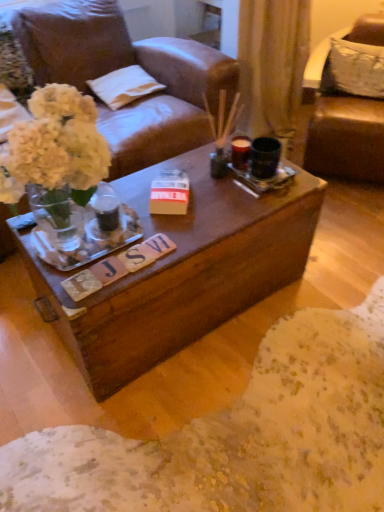
What is the approximate height of brown leather chair at upper right?

28.32 inches.

Describe the element at coordinates (356, 68) in the screenshot. I see `white fabric pillow at upper right, acting as the second pillow starting from the left` at that location.

The height and width of the screenshot is (512, 384). What do you see at coordinates (124, 86) in the screenshot?
I see `white cotton pillow at upper center, which appears as the 1th pillow when viewed from the left` at bounding box center [124, 86].

Identify the location of brown leather chair at upper right. Image resolution: width=384 pixels, height=512 pixels. (350, 106).

Does point (124, 71) appear closer or farther from the camera than point (365, 108)?

Point (124, 71) is farther from the camera than point (365, 108).

Considering the positions of objects white cotton pillow at upper center, which appears as the 1th pillow when viewed from the left, and brown leather chair at upper right in the image provided, who is more to the left, white cotton pillow at upper center, which appears as the 1th pillow when viewed from the left, or brown leather chair at upper right?

white cotton pillow at upper center, which appears as the 1th pillow when viewed from the left.

Considering the relative positions of white cotton pillow at upper center, the 2th pillow viewed from the right, and brown leather chair at upper right in the image provided, is white cotton pillow at upper center, the 2th pillow viewed from the right, in front of brown leather chair at upper right?

No, white cotton pillow at upper center, the 2th pillow viewed from the right, is further to the viewer.

Is white fabric pillow at upper right, acting as the second pillow starting from the left, outside of brown leather chair at upper right?

No, white fabric pillow at upper right, acting as the second pillow starting from the left, is inside or overlapping with brown leather chair at upper right.

How different are the orientations of white fabric pillow at upper right, the first pillow viewed from the right, and brown leather chair at upper right in degrees?

The angle between the facing direction of white fabric pillow at upper right, the first pillow viewed from the right, and the facing direction of brown leather chair at upper right is 1.62 degrees.

Between white fabric pillow at upper right, the first pillow viewed from the right, and brown leather chair at upper right, which one has less height?

With less height is white fabric pillow at upper right, the first pillow viewed from the right.

Does white cotton pillow at upper center, which appears as the 1th pillow when viewed from the left, have a greater height compared to white fabric pillow at upper right, acting as the second pillow starting from the left?

Incorrect, the height of white cotton pillow at upper center, which appears as the 1th pillow when viewed from the left, is not larger of that of white fabric pillow at upper right, acting as the second pillow starting from the left.

Which point is more forward, (129, 68) or (354, 93)?

The point (354, 93) is closer.

From the image's perspective, which one is positioned lower, white cotton pillow at upper center, which appears as the 1th pillow when viewed from the left, or white fabric pillow at upper right, the first pillow viewed from the right?

white cotton pillow at upper center, which appears as the 1th pillow when viewed from the left, is shown below in the image.

Consider the image. Is white cotton pillow at upper center, the 2th pillow viewed from the right, facing away from white fabric pillow at upper right, acting as the second pillow starting from the left?

No, white cotton pillow at upper center, the 2th pillow viewed from the right,'s orientation is not away from white fabric pillow at upper right, acting as the second pillow starting from the left.

From the image's perspective, between white fabric pillow at upper right, acting as the second pillow starting from the left, and white cotton pillow at upper center, the 2th pillow viewed from the right, which one is located above?

white fabric pillow at upper right, acting as the second pillow starting from the left, appears higher in the image.

Which of these two, white fabric pillow at upper right, the first pillow viewed from the right, or white cotton pillow at upper center, the 2th pillow viewed from the right, is thinner?

Thinner between the two is white fabric pillow at upper right, the first pillow viewed from the right.

Between white fabric pillow at upper right, the first pillow viewed from the right, and white cotton pillow at upper center, which appears as the 1th pillow when viewed from the left, which one has less height?

white cotton pillow at upper center, which appears as the 1th pillow when viewed from the left, is shorter.

From a real-world perspective, is white fabric pillow at upper right, the first pillow viewed from the right, physically located above or below white cotton pillow at upper center, the 2th pillow viewed from the right?

Clearly, from a real-world perspective, white fabric pillow at upper right, the first pillow viewed from the right, is above white cotton pillow at upper center, the 2th pillow viewed from the right.

Is brown leather chair at upper right spatially inside white cotton pillow at upper center, which appears as the 1th pillow when viewed from the left, or outside of it?

brown leather chair at upper right cannot be found inside white cotton pillow at upper center, which appears as the 1th pillow when viewed from the left.

In terms of size, does brown leather chair at upper right appear bigger or smaller than white cotton pillow at upper center, the 2th pillow viewed from the right?

In the image, brown leather chair at upper right appears to be larger than white cotton pillow at upper center, the 2th pillow viewed from the right.

Considering the relative sizes of brown leather chair at upper right and white cotton pillow at upper center, the 2th pillow viewed from the right, in the image provided, is brown leather chair at upper right wider than white cotton pillow at upper center, the 2th pillow viewed from the right,?

Correct, the width of brown leather chair at upper right exceeds that of white cotton pillow at upper center, the 2th pillow viewed from the right.

Is brown leather chair at upper right positioned behind white fabric pillow at upper right, acting as the second pillow starting from the left?

No, the depth of brown leather chair at upper right is less than that of white fabric pillow at upper right, acting as the second pillow starting from the left.

In terms of width, does brown leather chair at upper right look wider or thinner when compared to white fabric pillow at upper right, the first pillow viewed from the right?

In the image, brown leather chair at upper right appears to be wider than white fabric pillow at upper right, the first pillow viewed from the right.

Is brown leather chair at upper right oriented away from white fabric pillow at upper right, the first pillow viewed from the right?

That's right, brown leather chair at upper right is facing away from white fabric pillow at upper right, the first pillow viewed from the right.

Which of these two, brown leather chair at upper right or white fabric pillow at upper right, acting as the second pillow starting from the left, is smaller?

white fabric pillow at upper right, acting as the second pillow starting from the left, is smaller.

At what (x,y) coordinates should I click in order to perform the action: click on chair that is in front of the white cotton pillow at upper center, which appears as the 1th pillow when viewed from the left. Please return your answer as a coordinate pair (x, y). The height and width of the screenshot is (512, 384). Looking at the image, I should click on tap(350, 106).

Image resolution: width=384 pixels, height=512 pixels. In order to click on the 2nd pillow above the brown leather chair at upper right (from the image's perspective) in this screenshot , I will do `click(356, 68)`.

Considering their positions, is brown leather chair at upper right positioned further to white fabric pillow at upper right, acting as the second pillow starting from the left, than white cotton pillow at upper center, the 2th pillow viewed from the right?

Based on the image, white cotton pillow at upper center, the 2th pillow viewed from the right, appears to be further to white fabric pillow at upper right, acting as the second pillow starting from the left.

Considering their positions, is white fabric pillow at upper right, acting as the second pillow starting from the left, positioned further to white cotton pillow at upper center, the 2th pillow viewed from the right, than brown leather chair at upper right?

Among the two, white fabric pillow at upper right, acting as the second pillow starting from the left, is located further to white cotton pillow at upper center, the 2th pillow viewed from the right.

Based on their spatial positions, is white cotton pillow at upper center, the 2th pillow viewed from the right, or white fabric pillow at upper right, the first pillow viewed from the right, further from brown leather chair at upper right?

The object further to brown leather chair at upper right is white cotton pillow at upper center, the 2th pillow viewed from the right.

When comparing their distances from brown leather chair at upper right, does white fabric pillow at upper right, acting as the second pillow starting from the left, or white cotton pillow at upper center, the 2th pillow viewed from the right, seem further?

Among the two, white cotton pillow at upper center, the 2th pillow viewed from the right, is located further to brown leather chair at upper right.

From the image, which object appears to be nearer to white fabric pillow at upper right, the first pillow viewed from the right, white cotton pillow at upper center, which appears as the 1th pillow when viewed from the left, or brown leather chair at upper right?

brown leather chair at upper right.

Which object lies nearer to the anchor point white cotton pillow at upper center, the 2th pillow viewed from the right, brown leather chair at upper right or white fabric pillow at upper right, the first pillow viewed from the right?

Based on the image, brown leather chair at upper right appears to be nearer to white cotton pillow at upper center, the 2th pillow viewed from the right.

Where is `chair situated between white cotton pillow at upper center, which appears as the 1th pillow when viewed from the left, and white fabric pillow at upper right, the first pillow viewed from the right, from left to right`? The image size is (384, 512). chair situated between white cotton pillow at upper center, which appears as the 1th pillow when viewed from the left, and white fabric pillow at upper right, the first pillow viewed from the right, from left to right is located at coordinates (350, 106).